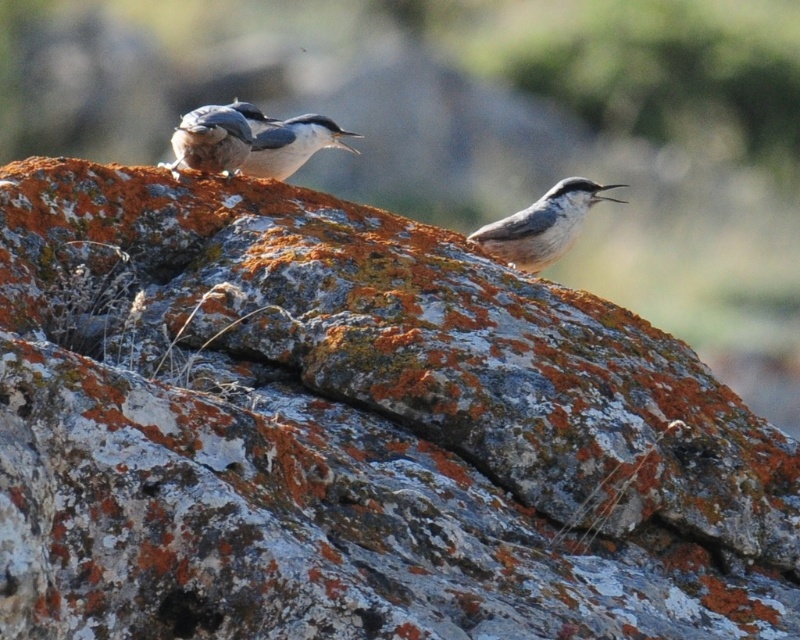
You are a birdwatcher trying to identify the birds in the image. You observe the brown speckled bird at center and the matte gray bird at upper left. Which bird is shorter in height?

The brown speckled bird at center is shorter than the matte gray bird at upper left.

You are a photographer using a camera with a shallow depth of field. You notice two birds in the scene, the matte gray bird at upper left and the white matte bird at center. Which bird will appear more in focus in your photo?

The matte gray bird at upper left will appear more in focus because it is closer to the viewer than the white matte bird at center, and the shallow depth of field keeps the background blurred while keeping the subject in focus.

You are a photographer trying to capture the matte gray bird at upper left. Based on the coordinates provided, where should you focus your camera to ensure the bird is in sharp focus?

The matte gray bird at upper left is positioned at coordinates point (216,136), so you should focus your camera at that point to ensure the bird is in sharp focus.